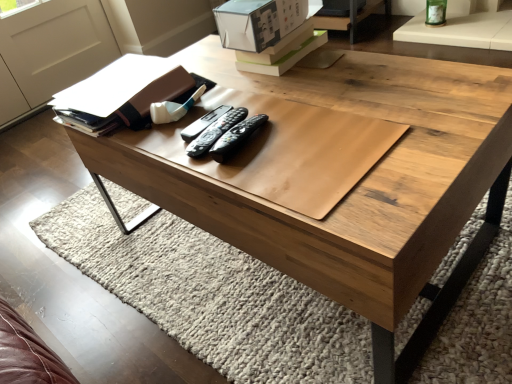
At what (x,y) coordinates should I click in order to perform the action: click on free space to the right of black plastic remote at center, acting as the 1th remote starting from the right. Please return your answer as a coordinate pair (x, y). The height and width of the screenshot is (384, 512). Looking at the image, I should click on (321, 126).